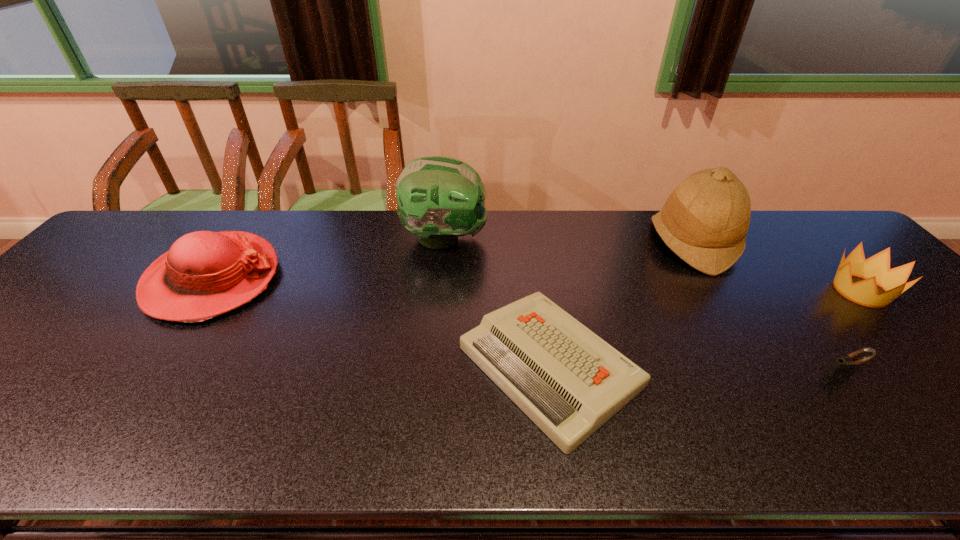
The height and width of the screenshot is (540, 960). What are the coordinates of `the taller hat` in the screenshot? It's located at (704, 221).

The height and width of the screenshot is (540, 960). Identify the location of football helmet. (440, 198).

Identify the location of the leftmost object. The image size is (960, 540). (204, 274).

I want to click on the fourth shortest object, so click(204, 274).

Find the location of a particular element. the fourth tallest object is located at coordinates (875, 270).

Locate an element on the screen. The image size is (960, 540). crown is located at coordinates (875, 270).

Where is `padlock`? This screenshot has width=960, height=540. padlock is located at coordinates (841, 367).

In order to click on computer keyboard in this screenshot , I will do `click(569, 381)`.

Find the location of `vacant space located 0.130m on the front-facing side of the right hat`. vacant space located 0.130m on the front-facing side of the right hat is located at coordinates (609, 242).

This screenshot has height=540, width=960. I want to click on vacant position located on the front-facing side of the right hat, so click(x=588, y=242).